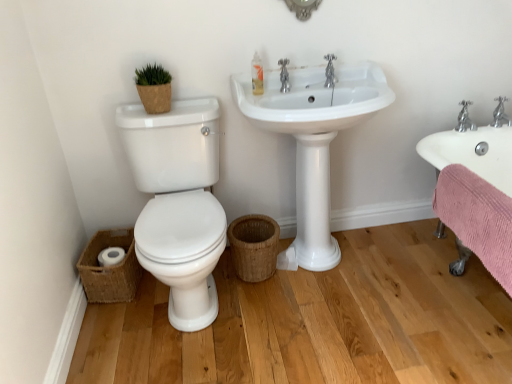
Identify the location of empty space that is to the right of woven brown basket at lower center, which appears as the 2th basket when viewed from the left. (307, 282).